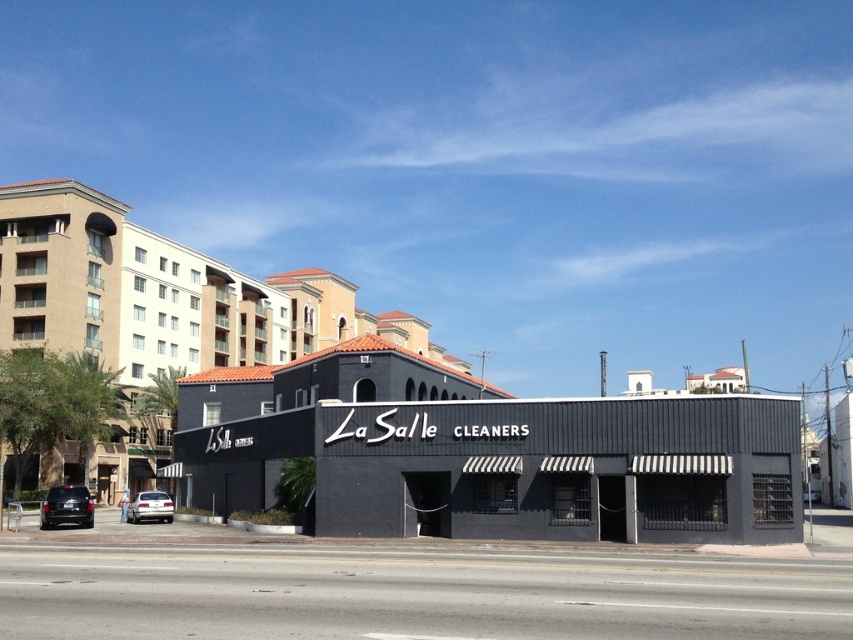
You are standing at the entrance of La Salle Cleaners and want to park your shiny black suv at lower left. The parking spot is located at point (67, 506). Can you safely drive your vehicle to that spot without hitting the building next to La Salle Cleaners?

The point (67, 506) indicates the shiny black suv at lower left, so you can safely drive your vehicle to that spot as it is already parked there.

You are a delivery person who needs to park your vehicle, which is the same size as the silver metallic sedan at lower left, near the La Salle Cleaners. Is there enough space between the beige stucco building at left and the building where La Salle Cleaners is located to park your vehicle?

The beige stucco building at left is larger in size compared to the silver metallic sedan at lower left. Since the beige stucco building at left is bigger, there might be sufficient space between it and the La Salle Cleaners building to park the vehicle of the same size as the silver metallic sedan at lower left.

You are standing at point (164, 296) in the image. What can you see at this location?

At point (164, 296) lies beige stucco building at left.